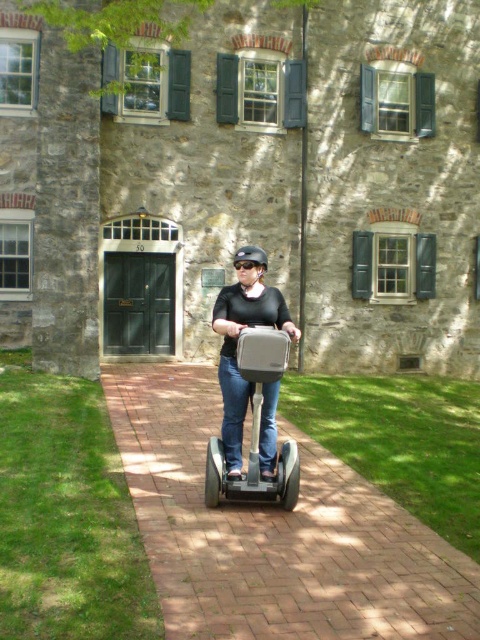
Based on the photo, which is below, matte gray scooter at center or black matte helmet at center?

matte gray scooter at center is lower down.

The height and width of the screenshot is (640, 480). What are the coordinates of `matte gray scooter at center` in the screenshot? It's located at (255, 428).

Is brick pavement at center closer to camera compared to matte gray scooter at center?

Yes, it is.

Does point (163, 616) come in front of point (296, 493)?

Yes, it is.

Does point (288, 556) come closer to viewer compared to point (288, 440)?

Yes, point (288, 556) is closer to viewer.

Where is `brick pavement at center`? The image size is (480, 640). brick pavement at center is located at coordinates (275, 532).

Is brick pavement at center thinner than black matte helmet at center?

Correct, brick pavement at center's width is less than black matte helmet at center's.

Who is shorter, brick pavement at center or black matte helmet at center?

With less height is brick pavement at center.

Describe the element at coordinates (275, 532) in the screenshot. The width and height of the screenshot is (480, 640). I see `brick pavement at center` at that location.

Locate an element on the screen. brick pavement at center is located at coordinates (275, 532).